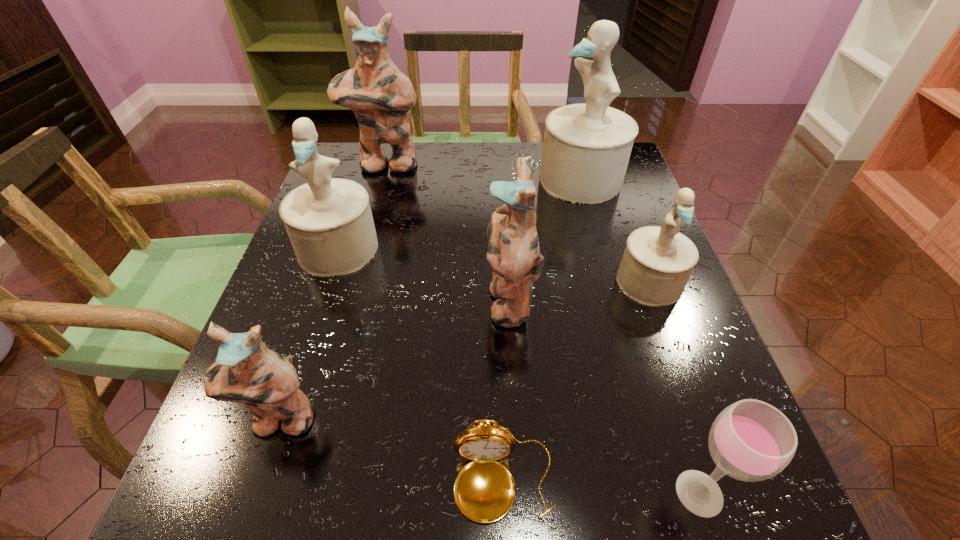
This screenshot has width=960, height=540. In order to click on blank area located on the back of the wineglass in this screenshot , I will do `click(635, 294)`.

The width and height of the screenshot is (960, 540). Find the location of `wineglass that is positioned at the near edge`. wineglass that is positioned at the near edge is located at coordinates (750, 440).

Identify the location of pocket watch that is at the near edge. (484, 490).

You are a GUI agent. You are given a task and a screenshot of the screen. Output one action in this format:
    pyautogui.click(x=<x>, y=<y>)
    Task: Click on the wineglass situated at the right edge
    
    Given the screenshot: What is the action you would take?
    pyautogui.click(x=750, y=440)

Identify the location of object at the far left corner. (380, 95).

Locate an element on the screen. This screenshot has height=540, width=960. object that is at the far right corner is located at coordinates (586, 149).

Where is `object present at the near right corner`? Image resolution: width=960 pixels, height=540 pixels. object present at the near right corner is located at coordinates (750, 440).

Identify the location of vacant space at the far edge of the desktop. (426, 170).

Find the location of a particular element. free space at the left edge of the desktop is located at coordinates (318, 293).

Find the location of a particular element. Image resolution: width=960 pixels, height=540 pixels. free space at the right edge is located at coordinates (592, 220).